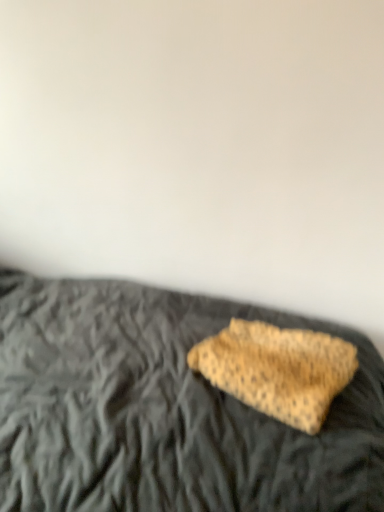
Identify the location of free space above leopard print fabric at center (from a real-world perspective). The width and height of the screenshot is (384, 512). (289, 350).